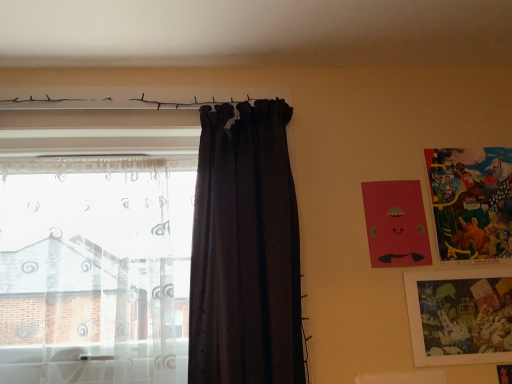
Describe the element at coordinates (471, 201) in the screenshot. I see `multicolored paper picture frame at upper right, acting as the third picture frame starting from the bottom` at that location.

This screenshot has width=512, height=384. What are the coordinates of `matte red picture frame at upper right, positioned as the second picture frame in top-to-bottom order` in the screenshot? It's located at (396, 224).

In order to click on matte plastic picture frame at lower right, which is counted as the first picture frame, starting from the bottom in this screenshot , I will do `click(460, 316)`.

This screenshot has width=512, height=384. I want to click on dark matte fabric curtain at center, acting as the second curtain starting from the left, so click(245, 251).

What are the coordinates of `multicolored paper picture frame at upper right, acting as the first picture frame starting from the top` in the screenshot? It's located at (471, 201).

Can you confirm if transparent sheer curtain at left, the 2th curtain when ordered from right to left, is smaller than matte red picture frame at upper right, positioned as the second picture frame in top-to-bottom order?

Actually, transparent sheer curtain at left, the 2th curtain when ordered from right to left, might be larger than matte red picture frame at upper right, positioned as the second picture frame in top-to-bottom order.

From the image's perspective, is transparent sheer curtain at left, the 2th curtain when ordered from right to left, above or below matte red picture frame at upper right, positioned as the second picture frame in top-to-bottom order?

transparent sheer curtain at left, the 2th curtain when ordered from right to left, is below matte red picture frame at upper right, positioned as the second picture frame in top-to-bottom order.

Looking at this image, is matte red picture frame at upper right, marked as the second picture frame in a bottom-to-top arrangement, a part of transparent sheer curtain at left, the 1th curtain from the left?

No, transparent sheer curtain at left, the 1th curtain from the left, does not contain matte red picture frame at upper right, marked as the second picture frame in a bottom-to-top arrangement.

From a real-world perspective, which object stands above the other?

From a 3D spatial view, matte red picture frame at upper right, positioned as the second picture frame in top-to-bottom order, is above.

Is transparent sheer curtain at left, the 2th curtain when ordered from right to left, positioned with its back to dark matte fabric curtain at center, the first curtain when ordered from right to left?

No, transparent sheer curtain at left, the 2th curtain when ordered from right to left, is not facing the opposite direction of dark matte fabric curtain at center, the first curtain when ordered from right to left.

Is transparent sheer curtain at left, the 2th curtain when ordered from right to left, thinner than dark matte fabric curtain at center, the first curtain when ordered from right to left?

Indeed, transparent sheer curtain at left, the 2th curtain when ordered from right to left, has a lesser width compared to dark matte fabric curtain at center, the first curtain when ordered from right to left.

Between point (185, 382) and point (289, 221), which one is positioned behind?

Positioned behind is point (289, 221).

In the scene shown: From a real-world perspective, is transparent sheer curtain at left, the 2th curtain when ordered from right to left, below dark matte fabric curtain at center, the first curtain when ordered from right to left?

Yes, from a real-world perspective, transparent sheer curtain at left, the 2th curtain when ordered from right to left, is under dark matte fabric curtain at center, the first curtain when ordered from right to left.

Considering their positions, is transparent sheer curtain at left, the 1th curtain from the left, located in front of or behind multicolored paper picture frame at upper right, acting as the third picture frame starting from the bottom?

Visually, transparent sheer curtain at left, the 1th curtain from the left, is located in front of multicolored paper picture frame at upper right, acting as the third picture frame starting from the bottom.

Is the surface of transparent sheer curtain at left, the 1th curtain from the left, in direct contact with multicolored paper picture frame at upper right, acting as the third picture frame starting from the bottom?

No, transparent sheer curtain at left, the 1th curtain from the left, is not in contact with multicolored paper picture frame at upper right, acting as the third picture frame starting from the bottom.

Looking at this image, from a real-world perspective, does transparent sheer curtain at left, the 2th curtain when ordered from right to left, stand above multicolored paper picture frame at upper right, acting as the third picture frame starting from the bottom?

No, from a real-world perspective, transparent sheer curtain at left, the 2th curtain when ordered from right to left, is not on top of multicolored paper picture frame at upper right, acting as the third picture frame starting from the bottom.

Is dark matte fabric curtain at center, acting as the second curtain starting from the left, turned away from matte red picture frame at upper right, marked as the second picture frame in a bottom-to-top arrangement?

That's not correct — dark matte fabric curtain at center, acting as the second curtain starting from the left, is not looking away from matte red picture frame at upper right, marked as the second picture frame in a bottom-to-top arrangement.

Is dark matte fabric curtain at center, the first curtain when ordered from right to left, bigger or smaller than matte red picture frame at upper right, positioned as the second picture frame in top-to-bottom order?

In the image, dark matte fabric curtain at center, the first curtain when ordered from right to left, appears to be larger than matte red picture frame at upper right, positioned as the second picture frame in top-to-bottom order.

Between dark matte fabric curtain at center, acting as the second curtain starting from the left, and matte red picture frame at upper right, marked as the second picture frame in a bottom-to-top arrangement, which one has more height?

With more height is dark matte fabric curtain at center, acting as the second curtain starting from the left.

Considering the relative sizes of dark matte fabric curtain at center, the first curtain when ordered from right to left, and matte red picture frame at upper right, marked as the second picture frame in a bottom-to-top arrangement, in the image provided, is dark matte fabric curtain at center, the first curtain when ordered from right to left, thinner than matte red picture frame at upper right, marked as the second picture frame in a bottom-to-top arrangement,?

Incorrect, the width of dark matte fabric curtain at center, the first curtain when ordered from right to left, is not less than that of matte red picture frame at upper right, marked as the second picture frame in a bottom-to-top arrangement.

From the image's perspective, would you say matte red picture frame at upper right, marked as the second picture frame in a bottom-to-top arrangement, is shown under multicolored paper picture frame at upper right, acting as the third picture frame starting from the bottom?

Yes, from the image's perspective, matte red picture frame at upper right, marked as the second picture frame in a bottom-to-top arrangement, is beneath multicolored paper picture frame at upper right, acting as the third picture frame starting from the bottom.

Locate an element on the screen. The image size is (512, 384). picture frame behind the matte red picture frame at upper right, marked as the second picture frame in a bottom-to-top arrangement is located at coordinates (471, 201).

Does point (362, 202) appear closer or farther from the camera than point (446, 167)?

Clearly, point (362, 202) is closer to the camera than point (446, 167).

How different are the orientations of matte plastic picture frame at lower right, which is counted as the first picture frame, starting from the bottom, and matte red picture frame at upper right, marked as the second picture frame in a bottom-to-top arrangement, in degrees?

The facing directions of matte plastic picture frame at lower right, which is counted as the first picture frame, starting from the bottom, and matte red picture frame at upper right, marked as the second picture frame in a bottom-to-top arrangement, are 0.0397 degrees apart.

Between matte plastic picture frame at lower right, which is counted as the first picture frame, starting from the bottom, and matte red picture frame at upper right, positioned as the second picture frame in top-to-bottom order, which one is positioned behind?

matte red picture frame at upper right, positioned as the second picture frame in top-to-bottom order, is further from the camera.

From the picture: Which is more to the right, matte plastic picture frame at lower right, which ranks as the 3th picture frame in top-to-bottom order, or matte red picture frame at upper right, marked as the second picture frame in a bottom-to-top arrangement?

matte plastic picture frame at lower right, which ranks as the 3th picture frame in top-to-bottom order, is more to the right.

Who is shorter, matte plastic picture frame at lower right, which is counted as the first picture frame, starting from the bottom, or matte red picture frame at upper right, marked as the second picture frame in a bottom-to-top arrangement?

With less height is matte plastic picture frame at lower right, which is counted as the first picture frame, starting from the bottom.

Is dark matte fabric curtain at center, the first curtain when ordered from right to left, turned away from transparent sheer curtain at left, the 1th curtain from the left?

No, transparent sheer curtain at left, the 1th curtain from the left, is not at the back of dark matte fabric curtain at center, the first curtain when ordered from right to left.

Considering the relative sizes of dark matte fabric curtain at center, the first curtain when ordered from right to left, and transparent sheer curtain at left, the 2th curtain when ordered from right to left, in the image provided, is dark matte fabric curtain at center, the first curtain when ordered from right to left, bigger than transparent sheer curtain at left, the 2th curtain when ordered from right to left,?

No, dark matte fabric curtain at center, the first curtain when ordered from right to left, is not bigger than transparent sheer curtain at left, the 2th curtain when ordered from right to left.

Between dark matte fabric curtain at center, acting as the second curtain starting from the left, and transparent sheer curtain at left, the 1th curtain from the left, which one appears on the right side from the viewer's perspective?

From the viewer's perspective, dark matte fabric curtain at center, acting as the second curtain starting from the left, appears more on the right side.

Considering the positions of objects dark matte fabric curtain at center, the first curtain when ordered from right to left, and transparent sheer curtain at left, the 2th curtain when ordered from right to left, in the image provided, who is behind, dark matte fabric curtain at center, the first curtain when ordered from right to left, or transparent sheer curtain at left, the 2th curtain when ordered from right to left,?

transparent sheer curtain at left, the 2th curtain when ordered from right to left, is further away from the camera.

This screenshot has height=384, width=512. Find the location of `the 2nd curtain located beneath the matte red picture frame at upper right, marked as the second picture frame in a bottom-to-top arrangement (from a real-world perspective)`. the 2nd curtain located beneath the matte red picture frame at upper right, marked as the second picture frame in a bottom-to-top arrangement (from a real-world perspective) is located at coordinates (95, 269).

You are a GUI agent. You are given a task and a screenshot of the screen. Output one action in this format:
    pyautogui.click(x=<x>, y=<y>)
    Task: Click on the curtain above the transparent sheer curtain at left, the 1th curtain from the left (from the image's perspective)
    This screenshot has width=512, height=384.
    Given the screenshot: What is the action you would take?
    pyautogui.click(x=245, y=251)

From the image, which object appears to be farther from multicolored paper picture frame at upper right, acting as the first picture frame starting from the top, matte red picture frame at upper right, positioned as the second picture frame in top-to-bottom order, or matte plastic picture frame at lower right, which ranks as the 3th picture frame in top-to-bottom order?

matte plastic picture frame at lower right, which ranks as the 3th picture frame in top-to-bottom order, lies further to multicolored paper picture frame at upper right, acting as the first picture frame starting from the top, than the other object.

Considering their positions, is matte plastic picture frame at lower right, which ranks as the 3th picture frame in top-to-bottom order, positioned closer to dark matte fabric curtain at center, the first curtain when ordered from right to left, than multicolored paper picture frame at upper right, acting as the third picture frame starting from the bottom?

matte plastic picture frame at lower right, which ranks as the 3th picture frame in top-to-bottom order.

Which object lies nearer to the anchor point multicolored paper picture frame at upper right, acting as the third picture frame starting from the bottom, dark matte fabric curtain at center, the first curtain when ordered from right to left, or matte red picture frame at upper right, marked as the second picture frame in a bottom-to-top arrangement?

matte red picture frame at upper right, marked as the second picture frame in a bottom-to-top arrangement, is positioned closer to the anchor multicolored paper picture frame at upper right, acting as the third picture frame starting from the bottom.

From the image, which object appears to be farther from transparent sheer curtain at left, the 1th curtain from the left, matte red picture frame at upper right, marked as the second picture frame in a bottom-to-top arrangement, or dark matte fabric curtain at center, acting as the second curtain starting from the left?

matte red picture frame at upper right, marked as the second picture frame in a bottom-to-top arrangement.

Considering their positions, is matte plastic picture frame at lower right, which is counted as the first picture frame, starting from the bottom, positioned further to transparent sheer curtain at left, the 1th curtain from the left, than matte red picture frame at upper right, marked as the second picture frame in a bottom-to-top arrangement?

matte plastic picture frame at lower right, which is counted as the first picture frame, starting from the bottom, lies further to transparent sheer curtain at left, the 1th curtain from the left, than the other object.

Looking at the image, which one is located further to multicolored paper picture frame at upper right, acting as the first picture frame starting from the top, dark matte fabric curtain at center, acting as the second curtain starting from the left, or matte plastic picture frame at lower right, which is counted as the first picture frame, starting from the bottom?

Among the two, dark matte fabric curtain at center, acting as the second curtain starting from the left, is located further to multicolored paper picture frame at upper right, acting as the first picture frame starting from the top.

Considering their positions, is matte red picture frame at upper right, positioned as the second picture frame in top-to-bottom order, positioned closer to dark matte fabric curtain at center, the first curtain when ordered from right to left, than matte plastic picture frame at lower right, which is counted as the first picture frame, starting from the bottom?

matte red picture frame at upper right, positioned as the second picture frame in top-to-bottom order, is closer to dark matte fabric curtain at center, the first curtain when ordered from right to left.

Based on their spatial positions, is dark matte fabric curtain at center, the first curtain when ordered from right to left, or transparent sheer curtain at left, the 1th curtain from the left, further from matte red picture frame at upper right, positioned as the second picture frame in top-to-bottom order?

The object further to matte red picture frame at upper right, positioned as the second picture frame in top-to-bottom order, is transparent sheer curtain at left, the 1th curtain from the left.

You are a GUI agent. You are given a task and a screenshot of the screen. Output one action in this format:
    pyautogui.click(x=<x>, y=<y>)
    Task: Click on the picture frame that lies between multicolored paper picture frame at upper right, acting as the third picture frame starting from the bottom, and matte plastic picture frame at lower right, which is counted as the first picture frame, starting from the bottom, from top to bottom
    
    Given the screenshot: What is the action you would take?
    pyautogui.click(x=396, y=224)

At what (x,y) coordinates should I click in order to perform the action: click on picture frame located between dark matte fabric curtain at center, acting as the second curtain starting from the left, and matte plastic picture frame at lower right, which ranks as the 3th picture frame in top-to-bottom order, in the left-right direction. Please return your answer as a coordinate pair (x, y). Looking at the image, I should click on (396, 224).

Locate an element on the screen. This screenshot has width=512, height=384. curtain between transparent sheer curtain at left, the 2th curtain when ordered from right to left, and matte plastic picture frame at lower right, which ranks as the 3th picture frame in top-to-bottom order, in the horizontal direction is located at coordinates (245, 251).

Locate an element on the screen. This screenshot has width=512, height=384. curtain between transparent sheer curtain at left, the 2th curtain when ordered from right to left, and multicolored paper picture frame at upper right, acting as the third picture frame starting from the bottom, from left to right is located at coordinates (245, 251).